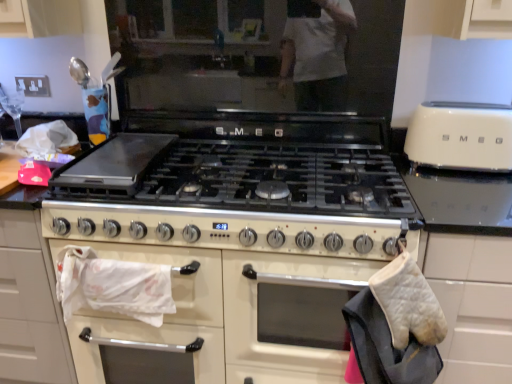
Measure the distance between point (x=423, y=135) and camera.

They are 1.46 meters apart.

You are a GUI agent. You are given a task and a screenshot of the screen. Output one action in this format:
    pyautogui.click(x=<x>, y=<y>)
    Task: Click on the white quilted oven mitt at right
    The height and width of the screenshot is (384, 512).
    Given the screenshot: What is the action you would take?
    pyautogui.click(x=396, y=326)

Identify the location of white glossy oven at center. Image resolution: width=512 pixels, height=384 pixels. (229, 234).

Image resolution: width=512 pixels, height=384 pixels. In order to click on ivory matte toaster at right in this screenshot , I will do `click(461, 136)`.

Considering the sizes of white quilted oven mitt at right and white glossy oven at center in the image, is white quilted oven mitt at right wider or thinner than white glossy oven at center?

Considering their sizes, white quilted oven mitt at right looks slimmer than white glossy oven at center.

From the image's perspective, is white quilted oven mitt at right located above or below white glossy oven at center?

white quilted oven mitt at right is above white glossy oven at center.

From a real-world perspective, between white quilted oven mitt at right and white glossy oven at center, who is vertically lower?

white glossy oven at center, from a real-world perspective.

Considering the sizes of objects white quilted oven mitt at right and white glossy oven at center in the image provided, who is taller, white quilted oven mitt at right or white glossy oven at center?

white glossy oven at center is taller.

From the image's perspective, between ivory matte toaster at right and white glossy oven at center, which one is located above?

ivory matte toaster at right.

Are ivory matte toaster at right and white glossy oven at center located far from each other?

No, ivory matte toaster at right is not far from white glossy oven at center.

Is ivory matte toaster at right wider than white glossy oven at center?

Incorrect, the width of ivory matte toaster at right does not surpass that of white glossy oven at center.

From the image's perspective, does white quilted oven mitt at right appear lower than ivory matte toaster at right?

Yes, from the image's perspective, white quilted oven mitt at right is below ivory matte toaster at right.

How different are the orientations of white quilted oven mitt at right and ivory matte toaster at right in degrees?

They differ by 0.706 degrees in their facing directions.

Can you confirm if white quilted oven mitt at right is taller than ivory matte toaster at right?

Yes.

Considering the points (413, 377) and (439, 118), which point is in front, point (413, 377) or point (439, 118)?

The point (413, 377) is closer to the camera.

Based on the photo, considering the relative sizes of white glossy oven at center and ivory matte toaster at right in the image provided, is white glossy oven at center bigger than ivory matte toaster at right?

Indeed, white glossy oven at center has a larger size compared to ivory matte toaster at right.

Measure the distance between white glossy oven at center and ivory matte toaster at right.

white glossy oven at center and ivory matte toaster at right are 23.31 inches apart.

Does point (312, 283) lie in front of point (492, 166)?

Yes, point (312, 283) is in front of point (492, 166).

In the scene shown: Is ivory matte toaster at right aimed at white quilted oven mitt at right?

No, ivory matte toaster at right is not facing towards white quilted oven mitt at right.

Based on the photo, between ivory matte toaster at right and white quilted oven mitt at right, which one has less height?

ivory matte toaster at right.

Based on the photo, are ivory matte toaster at right and white quilted oven mitt at right far apart?

ivory matte toaster at right is actually quite close to white quilted oven mitt at right.

Does white glossy oven at center have a greater width compared to white quilted oven mitt at right?

Yes.

Does point (356, 142) appear closer or farther from the camera than point (389, 358)?

Point (356, 142) is positioned farther from the camera compared to point (389, 358).

From a real-world perspective, is white glossy oven at center on top of white quilted oven mitt at right?

No, from a real-world perspective, white glossy oven at center is not on top of white quilted oven mitt at right.

This screenshot has height=384, width=512. I want to click on appliance that is behind the white quilted oven mitt at right, so click(x=229, y=234).

Find the location of a particular element. appliance below the ivory matte toaster at right (from a real-world perspective) is located at coordinates point(229,234).

Estimate the real-world distances between objects in this image. Which object is closer to ivory matte toaster at right, white glossy oven at center or white quilted oven mitt at right?

white quilted oven mitt at right is closer to ivory matte toaster at right.

Based on their spatial positions, is white quilted oven mitt at right or white glossy oven at center further from ivory matte toaster at right?

white glossy oven at center is positioned further to the anchor ivory matte toaster at right.

Estimate the real-world distances between objects in this image. Which object is further from white quilted oven mitt at right, white glossy oven at center or ivory matte toaster at right?

ivory matte toaster at right is further to white quilted oven mitt at right.

Looking at this image, when comparing their distances from white glossy oven at center, does white quilted oven mitt at right or ivory matte toaster at right seem further?

Based on the image, ivory matte toaster at right appears to be further to white glossy oven at center.

When comparing their distances from white quilted oven mitt at right, does ivory matte toaster at right or white glossy oven at center seem further?

ivory matte toaster at right.

Which object lies further to the anchor point white glossy oven at center, ivory matte toaster at right or white quilted oven mitt at right?

Based on the image, ivory matte toaster at right appears to be further to white glossy oven at center.

In order to click on material located between white glossy oven at center and ivory matte toaster at right in the left-right direction in this screenshot , I will do `click(396, 326)`.